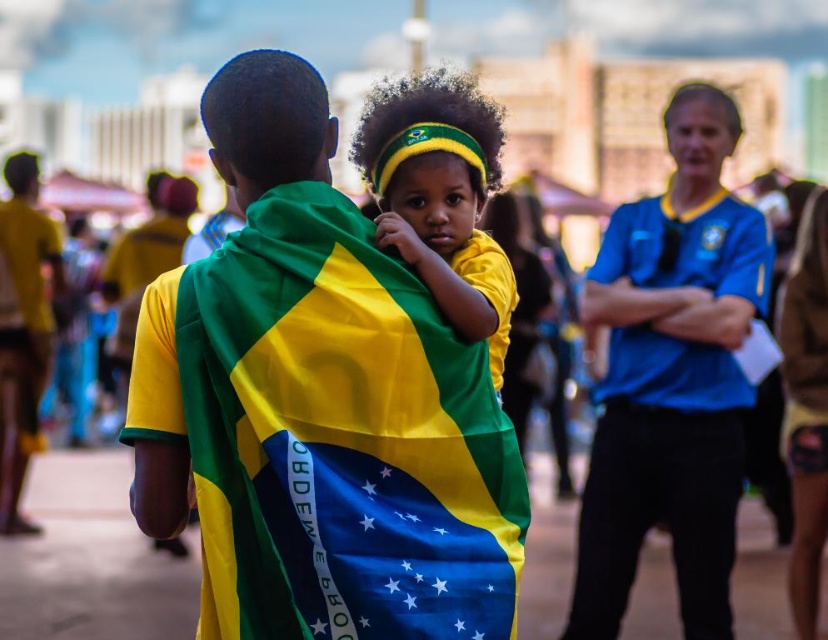
Question: Which object is closer to the camera taking this photo?

Choices:
 (A) matte fabric boy at center
 (B) matte yellow headband at center

Answer: (A)

Question: Can you confirm if matte fabric boy at center is smaller than matte yellow headband at center?

Choices:
 (A) no
 (B) yes

Answer: (A)

Question: Which point is closer to the camera taking this photo?

Choices:
 (A) (330, 627)
 (B) (431, 116)

Answer: (A)

Question: Does matte fabric boy at center have a larger size compared to matte yellow headband at center?

Choices:
 (A) yes
 (B) no

Answer: (A)

Question: Considering the relative positions of matte fabric boy at center and matte yellow headband at center in the image provided, where is matte fabric boy at center located with respect to matte yellow headband at center?

Choices:
 (A) left
 (B) right

Answer: (A)